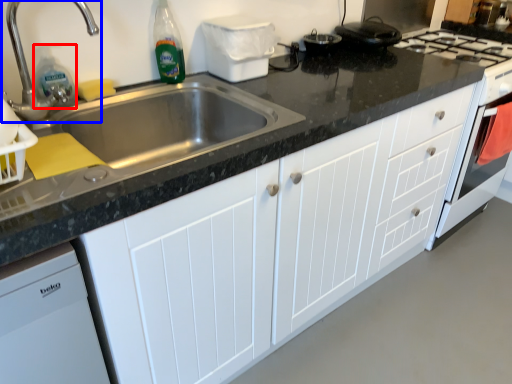
Question: Among these objects, which one is farthest to the camera, cleaning product (highlighted by a red box) or tap (highlighted by a blue box)?

Choices:
 (A) cleaning product
 (B) tap

Answer: (A)